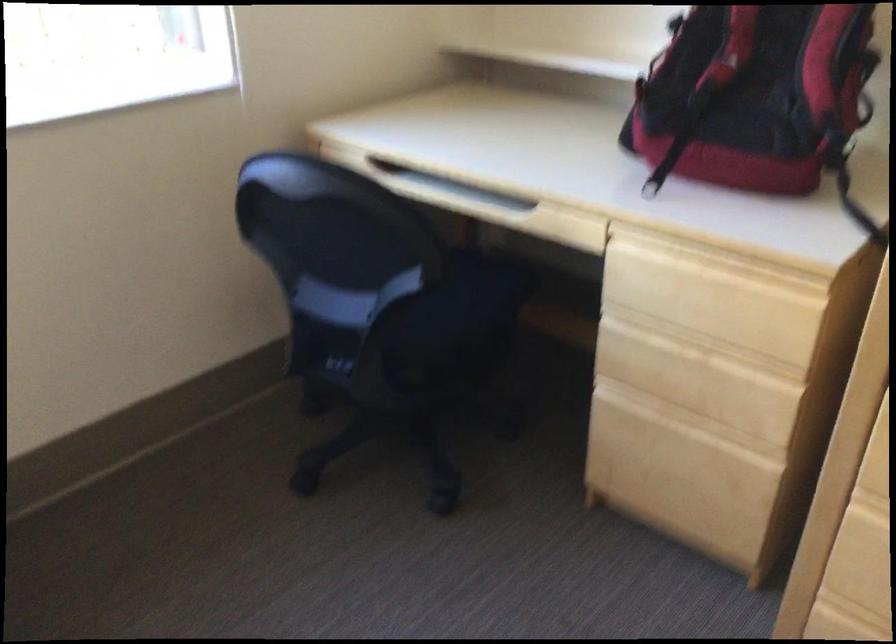
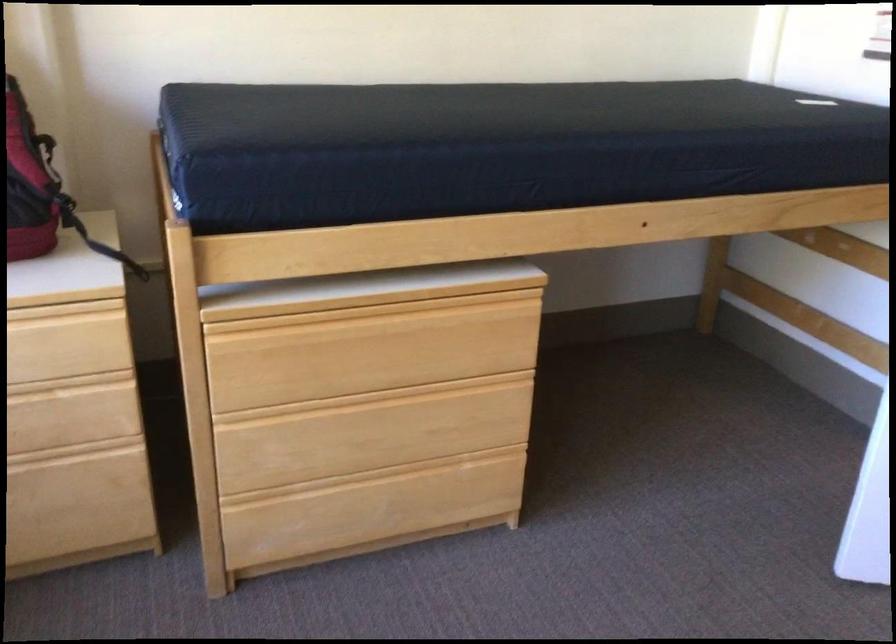
Where in the second image is the point corresponding to point 743,307 from the first image?

(67, 348)